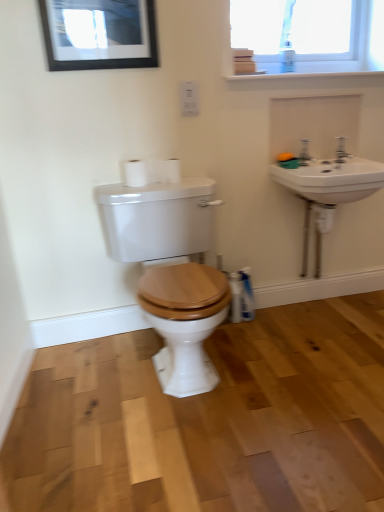
Question: Does matte black picture frame at upper left have a larger size compared to silver metallic faucet at upper right?

Choices:
 (A) yes
 (B) no

Answer: (A)

Question: Is matte black picture frame at upper left far from silver metallic faucet at upper right?

Choices:
 (A) no
 (B) yes

Answer: (B)

Question: Is silver metallic faucet at upper right at the back of matte black picture frame at upper left?

Choices:
 (A) yes
 (B) no

Answer: (B)

Question: From the image's perspective, is matte black picture frame at upper left located above silver metallic faucet at upper right?

Choices:
 (A) no
 (B) yes

Answer: (B)

Question: Does matte black picture frame at upper left have a greater height compared to silver metallic faucet at upper right?

Choices:
 (A) no
 (B) yes

Answer: (B)

Question: Is silver metallic faucet at upper right completely or partially inside matte black picture frame at upper left?

Choices:
 (A) yes
 (B) no

Answer: (B)

Question: Would you say white matte toilet paper at upper center, which appears as the first toilet paper when viewed from the left, contains white ceramic sink at upper right?

Choices:
 (A) yes
 (B) no

Answer: (B)

Question: Is white matte toilet paper at upper center, which appears as the 2th toilet paper when viewed from the right, not close to white ceramic sink at upper right?

Choices:
 (A) yes
 (B) no

Answer: (B)

Question: Is white matte toilet paper at upper center, which appears as the first toilet paper when viewed from the left, located outside white ceramic sink at upper right?

Choices:
 (A) no
 (B) yes

Answer: (B)

Question: Considering the relative sizes of white matte toilet paper at upper center, which appears as the 2th toilet paper when viewed from the right, and white ceramic sink at upper right in the image provided, is white matte toilet paper at upper center, which appears as the 2th toilet paper when viewed from the right, bigger than white ceramic sink at upper right?

Choices:
 (A) no
 (B) yes

Answer: (B)

Question: Could you tell me if white matte toilet paper at upper center, which appears as the 2th toilet paper when viewed from the right, is facing white ceramic sink at upper right?

Choices:
 (A) no
 (B) yes

Answer: (A)

Question: From the image's perspective, is white matte toilet paper at upper center, which appears as the 2th toilet paper when viewed from the right, located above white ceramic sink at upper right?

Choices:
 (A) no
 (B) yes

Answer: (A)

Question: Can you confirm if silver metallic faucet at upper right is positioned to the right of wooden toilet seat at center?

Choices:
 (A) no
 (B) yes

Answer: (B)